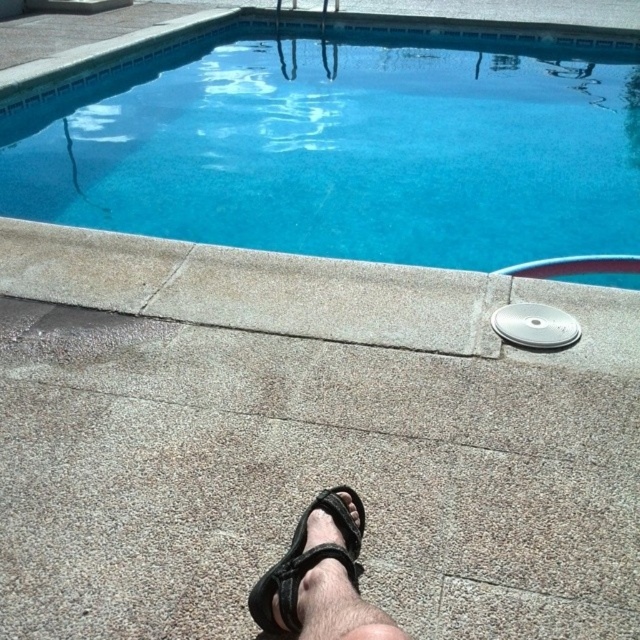
Based on the photo, you are a lifeguard standing at the edge of the pool. You see the blue concrete swimming pool at upper center and the black fabric sandal at lower center. Which object is closer to you?

The blue concrete swimming pool at upper center is closer to you because it is further to the viewer than the black fabric sandal at lower center.

You are a drone operator trying to capture a photo of the blue concrete swimming pool at upper center. The drone is currently at position coordinates of point 0.3, 0.6. To get the best shot, you need to move the drone closer to the pool. In which direction should you move the drone horizontally? Please answer with either left, right, up, or down.

The blue concrete swimming pool at upper center is located at point (342,144). The drone is at (384,192). To move closer horizontally, the drone should move left and down since the pool is to the left and below the drone.